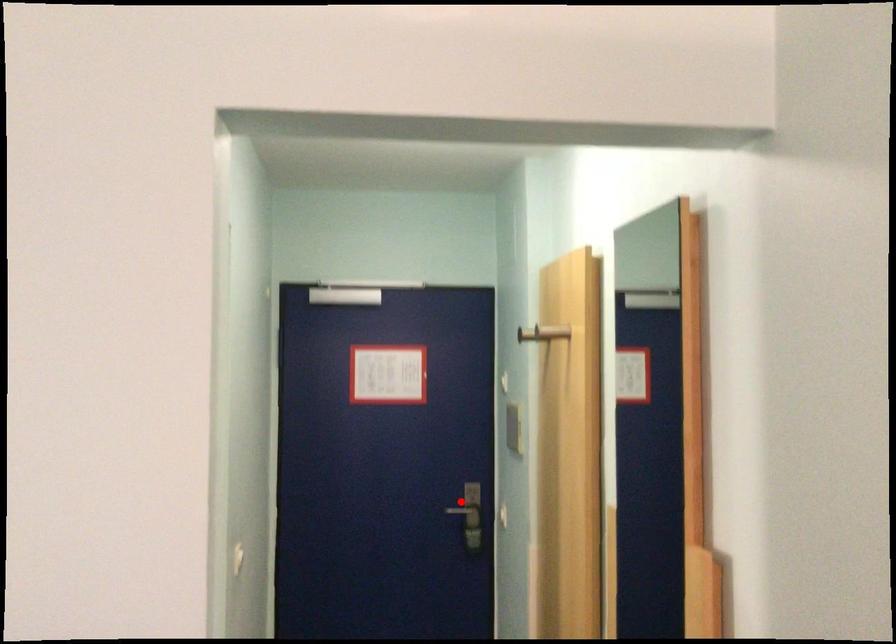
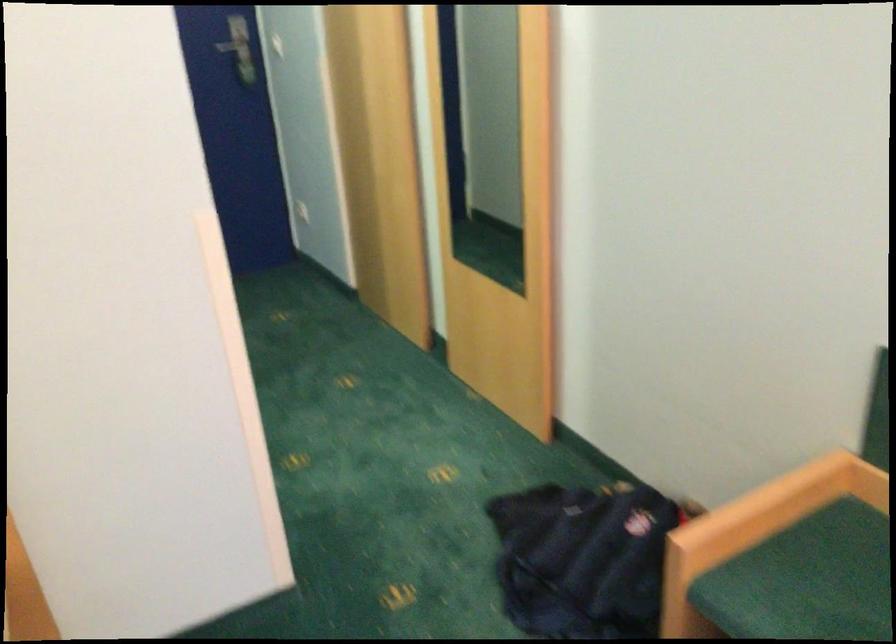
Find the pixel in the second image that matches the highlighted location in the first image.

(234, 46)